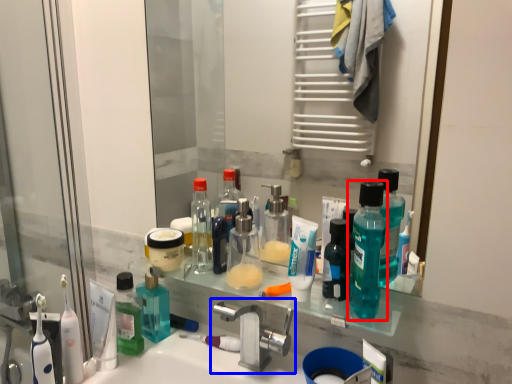
Question: Which object is closer to the camera taking this photo, bottle (highlighted by a red box) or tap (highlighted by a blue box)?

Choices:
 (A) bottle
 (B) tap

Answer: (A)